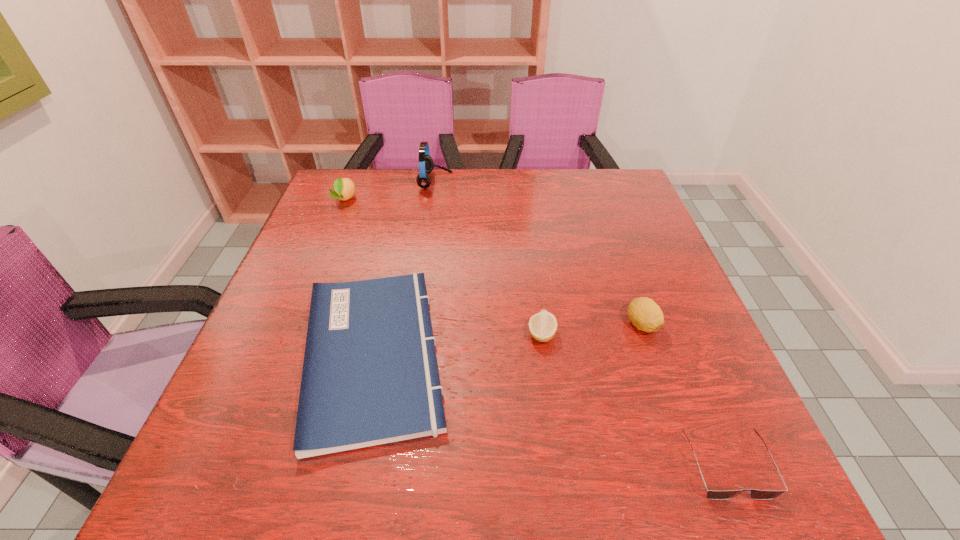
The height and width of the screenshot is (540, 960). I want to click on object that is at the far left corner, so click(x=344, y=188).

The height and width of the screenshot is (540, 960). What are the coordinates of `object present at the near left corner` in the screenshot? It's located at (370, 377).

Locate an element on the screen. This screenshot has height=540, width=960. object at the near right corner is located at coordinates (755, 494).

Locate an element on the screen. Image resolution: width=960 pixels, height=540 pixels. vacant space at the far edge of the desktop is located at coordinates (484, 199).

In order to click on free space at the near edge of the desktop in this screenshot , I will do `click(546, 457)`.

The image size is (960, 540). In order to click on free region at the left edge of the desktop in this screenshot , I will do `click(328, 240)`.

The height and width of the screenshot is (540, 960). I want to click on free space at the right edge, so click(624, 241).

Identify the location of free spot at the far left corner of the desktop. (354, 183).

The image size is (960, 540). I want to click on vacant region between the second lemon from right to left and the sunglasses, so click(x=634, y=400).

This screenshot has height=540, width=960. Find the location of `unoccupied position between the fourth object from left to right and the rightmost lemon`. unoccupied position between the fourth object from left to right and the rightmost lemon is located at coordinates (591, 329).